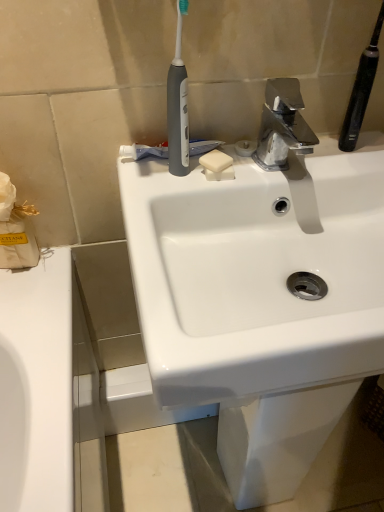
This screenshot has width=384, height=512. What are the coordinates of `free space to the right of white matte soap at center` in the screenshot? It's located at (302, 157).